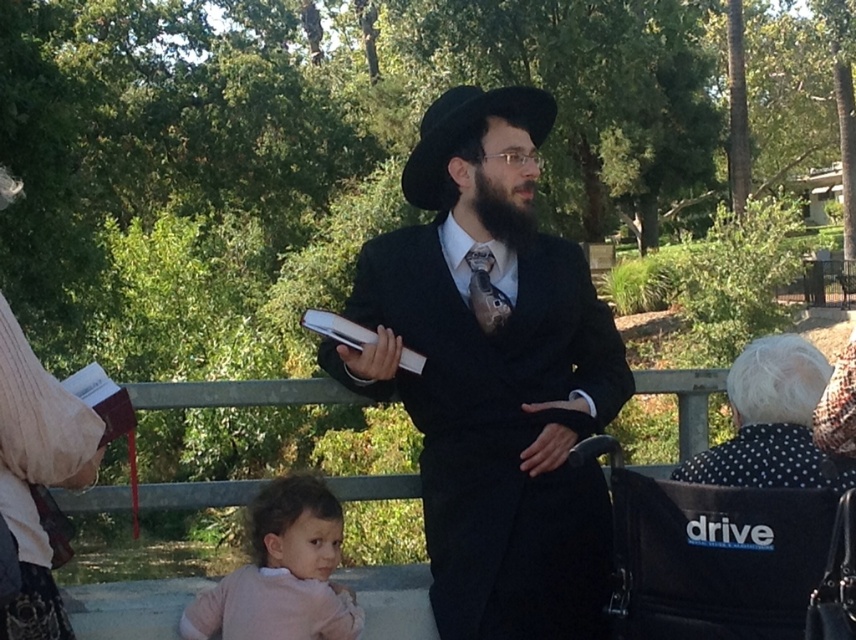
Question: Which point is farther to the camera?

Choices:
 (A) matte black suit at center
 (B) black dotted dress at lower right
 (C) pink soft fabric at lower left

Answer: (C)

Question: Which point appears farthest from the camera in this image?

Choices:
 (A) (334, 636)
 (B) (783, 397)

Answer: (A)

Question: Which point is closer to the camera?

Choices:
 (A) (741, 424)
 (B) (266, 536)
 (C) (491, 284)
 (D) (513, 218)

Answer: (A)

Question: Is matte black suit at center wider than black matte beard at center?

Choices:
 (A) no
 (B) yes

Answer: (B)

Question: Is pink soft fabric at lower left positioned in front of black matte beard at center?

Choices:
 (A) yes
 (B) no

Answer: (A)

Question: Can you confirm if matte black suit at center is positioned to the right of pink soft fabric at lower left?

Choices:
 (A) yes
 (B) no

Answer: (A)